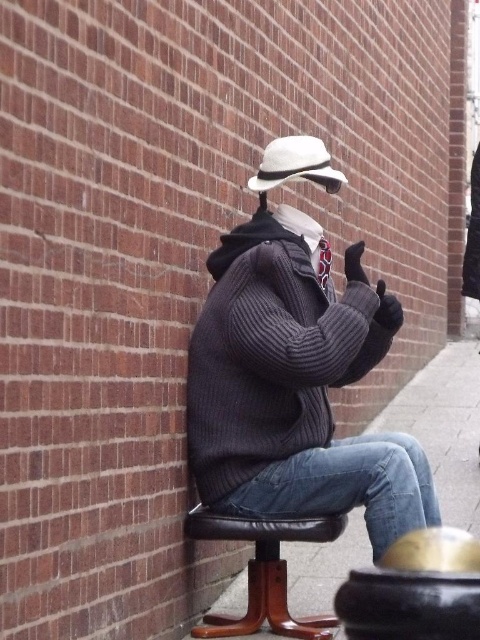
Does jeans at lower right lie in front of white felt hat at center?

No, it is behind white felt hat at center.

Who is more distant from viewer, (359, 560) or (320, 148)?

Point (359, 560)

What are the coordinates of `jeans at lower right` in the screenshot? It's located at (445, 426).

Between knitted sweater at center and jeans at lower right, which one is positioned lower?

jeans at lower right is lower down.

Can you confirm if knitted sweater at center is bigger than jeans at lower right?

Yes, knitted sweater at center is bigger than jeans at lower right.

Does point (272, 376) lie behind point (416, 422)?

No.

I want to click on knitted sweater at center, so click(295, 371).

The image size is (480, 640). What do you see at coordinates (295, 371) in the screenshot? I see `knitted sweater at center` at bounding box center [295, 371].

Measure the distance between point (225, 243) and camera.

The distance of point (225, 243) from camera is 11.55 feet.

Describe the element at coordinates (295, 371) in the screenshot. I see `knitted sweater at center` at that location.

Find the location of a particular element. knitted sweater at center is located at coordinates (295, 371).